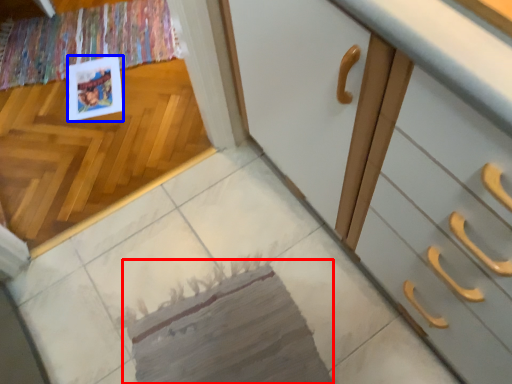
Question: Among these objects, which one is nearest to the camera, mat (highlighted by a red box) or postcard (highlighted by a blue box)?

Choices:
 (A) mat
 (B) postcard

Answer: (A)